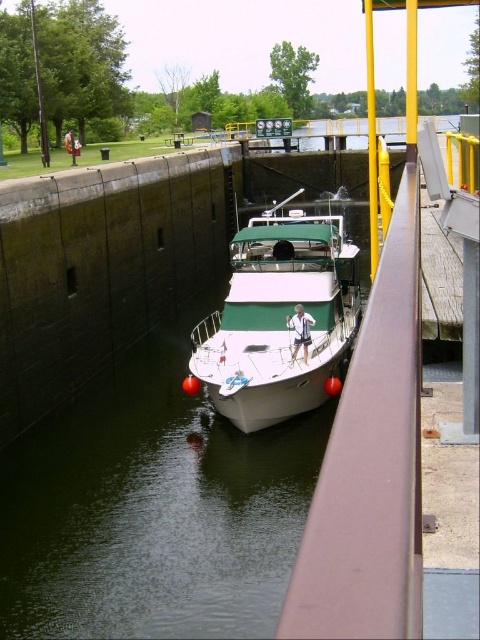
Question: Is white glossy water at center wider than white glossy boat at center?

Choices:
 (A) no
 (B) yes

Answer: (B)

Question: Which point is closer to the camera?

Choices:
 (A) white glossy boat at center
 (B) white glossy water at center

Answer: (B)

Question: Can you confirm if white glossy water at center is positioned to the left of white glossy boat at center?

Choices:
 (A) no
 (B) yes

Answer: (B)

Question: Does white glossy water at center have a smaller size compared to white glossy boat at center?

Choices:
 (A) no
 (B) yes

Answer: (B)